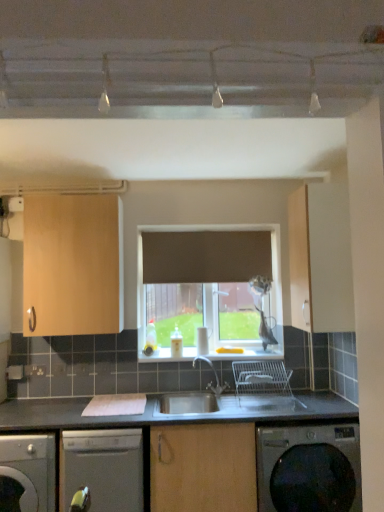
Question: From the image's perspective, is light wood cabinet at upper left, the first cabinetry viewed from the left, beneath dark gray metallic washing machine at lower right?

Choices:
 (A) no
 (B) yes

Answer: (A)

Question: Can you confirm if light wood cabinet at upper left, which ranks as the 2th cabinetry in right-to-left order, is shorter than dark gray metallic washing machine at lower right?

Choices:
 (A) no
 (B) yes

Answer: (A)

Question: Can you confirm if light wood cabinet at upper left, the first cabinetry viewed from the left, is smaller than dark gray metallic washing machine at lower right?

Choices:
 (A) yes
 (B) no

Answer: (A)

Question: From a real-world perspective, is light wood cabinet at upper left, which ranks as the 2th cabinetry in right-to-left order, located higher than dark gray metallic washing machine at lower right?

Choices:
 (A) yes
 (B) no

Answer: (A)

Question: From a real-world perspective, is light wood cabinet at upper left, which ranks as the 2th cabinetry in right-to-left order, positioned under dark gray metallic washing machine at lower right based on gravity?

Choices:
 (A) yes
 (B) no

Answer: (B)

Question: Considering the positions of satin silver dishwasher at lower left, the second dishwasher in the right-to-left sequence, and light wood cabinet at upper left, the first cabinetry viewed from the left, in the image, is satin silver dishwasher at lower left, the second dishwasher in the right-to-left sequence, taller or shorter than light wood cabinet at upper left, the first cabinetry viewed from the left,?

Choices:
 (A) short
 (B) tall

Answer: (A)

Question: Is satin silver dishwasher at lower left, acting as the first dishwasher starting from the left, inside the boundaries of light wood cabinet at upper left, which ranks as the 2th cabinetry in right-to-left order, or outside?

Choices:
 (A) inside
 (B) outside

Answer: (B)

Question: In terms of width, does satin silver dishwasher at lower left, acting as the first dishwasher starting from the left, look wider or thinner when compared to light wood cabinet at upper left, the first cabinetry viewed from the left?

Choices:
 (A) thin
 (B) wide

Answer: (B)

Question: From a real-world perspective, is satin silver dishwasher at lower left, the second dishwasher in the right-to-left sequence, physically located above or below light wood cabinet at upper left, which ranks as the 2th cabinetry in right-to-left order?

Choices:
 (A) below
 (B) above

Answer: (A)

Question: Would you say satin silver dishwasher at lower center, the 1th dishwasher viewed from the right, is inside or outside light wood cabinet at upper left, which ranks as the 2th cabinetry in right-to-left order?

Choices:
 (A) inside
 (B) outside

Answer: (B)

Question: Based on their positions, is satin silver dishwasher at lower center, acting as the second dishwasher starting from the left, located to the left or right of light wood cabinet at upper left, the first cabinetry viewed from the left?

Choices:
 (A) right
 (B) left

Answer: (A)

Question: Does point (107, 494) appear closer or farther from the camera than point (33, 227)?

Choices:
 (A) farther
 (B) closer

Answer: (B)

Question: Looking at their shapes, would you say satin silver dishwasher at lower center, the 1th dishwasher viewed from the right, is wider or thinner than light wood cabinet at upper left, the first cabinetry viewed from the left?

Choices:
 (A) wide
 (B) thin

Answer: (A)

Question: In terms of size, does matte wood cabinet at right, the second cabinetry when ordered from left to right, appear bigger or smaller than satin silver dishwasher at lower left, acting as the first dishwasher starting from the left?

Choices:
 (A) small
 (B) big

Answer: (A)

Question: From the image's perspective, is matte wood cabinet at right, the second cabinetry when ordered from left to right, positioned above or below satin silver dishwasher at lower left, acting as the first dishwasher starting from the left?

Choices:
 (A) below
 (B) above

Answer: (B)